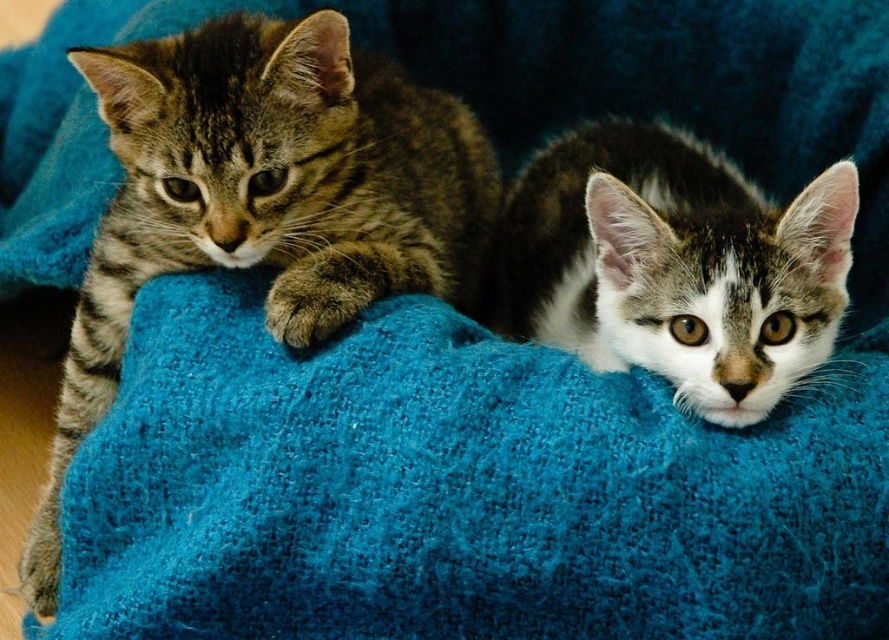
You are a cat owner who wants to place a new cat toy on the turquoise woolen blanket at center without disturbing the striped fur cat at left. Based on the scene description, where should you place the toy?

The turquoise woolen blanket at center is in front of the striped fur cat at left, so placing the toy on the blanket would be in front of the cat. To avoid disturbing the striped fur cat at left, place the toy behind it, away from the blanket.

You are a cat owner who wants to place a new turquoise woolen blanket at center on the floor where your tabby fur cat at center usually rests. Based on the image, will the blanket be long enough to fully cover your cat?

The turquoise woolen blanket at center is shorter than the tabby fur cat at center, so it will not be long enough to fully cover the cat.

You are a photographer standing 4 feet away from a striped fur cat at left. Can you take a clear photo of it without moving closer?

The striped fur cat at left is 3.99 feet from camera, so yes, you can take a clear photo of it without moving closer since you are already within the required distance.